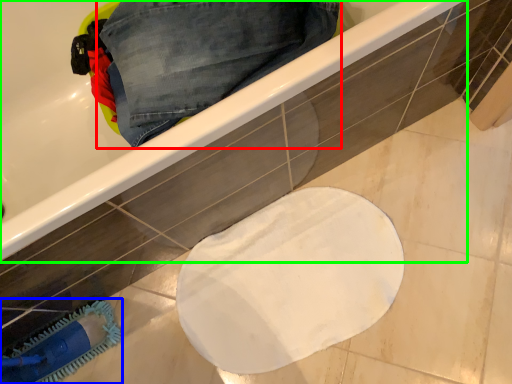
Question: Which object is the farthest from trousers (highlighted by a red box)? Choose among these: brush (highlighted by a blue box) or bathtub (highlighted by a green box).

Choices:
 (A) brush
 (B) bathtub

Answer: (A)